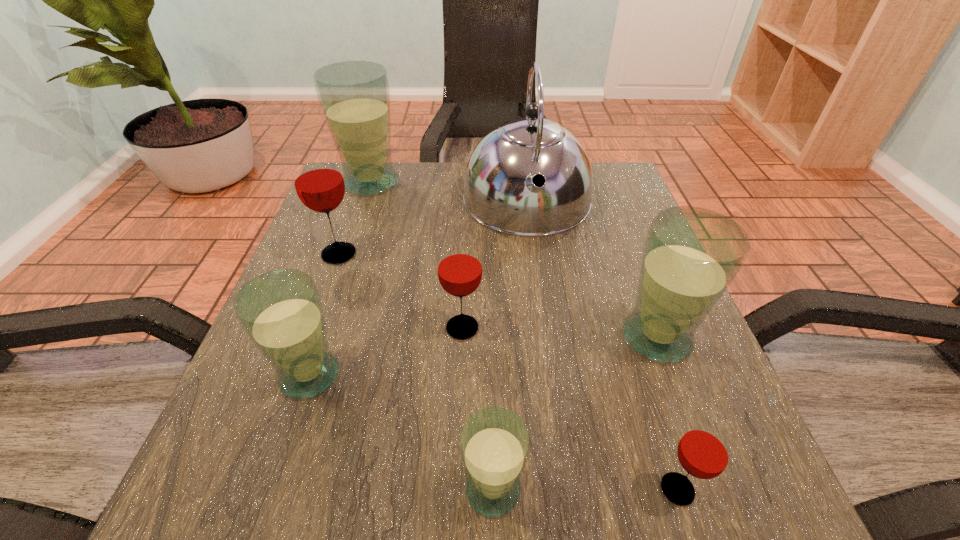
Image resolution: width=960 pixels, height=540 pixels. I want to click on kettle, so click(500, 193).

Identify the location of the tallest glass. Image resolution: width=960 pixels, height=540 pixels. (354, 96).

At what (x,y) coordinates should I click in order to perform the action: click on the biggest blue glass. Please return your answer as a coordinate pair (x, y). Looking at the image, I should click on (354, 96).

I want to click on the biggest red glass, so click(x=319, y=184).

Identify the location of the leftmost red glass. (319, 184).

The width and height of the screenshot is (960, 540). Find the location of `the rightmost blue glass`. the rightmost blue glass is located at coordinates (691, 255).

At what (x,y) coordinates should I click in order to perform the action: click on the second nearest red glass. Please return your answer as a coordinate pair (x, y). Looking at the image, I should click on (459, 267).

Where is `the second red glass from right to left`? This screenshot has height=540, width=960. the second red glass from right to left is located at coordinates (459, 267).

Locate an element on the screen. Image resolution: width=960 pixels, height=540 pixels. the third biggest blue glass is located at coordinates (281, 312).

The width and height of the screenshot is (960, 540). What are the coordinates of `the rightmost red glass` in the screenshot? It's located at (705, 450).